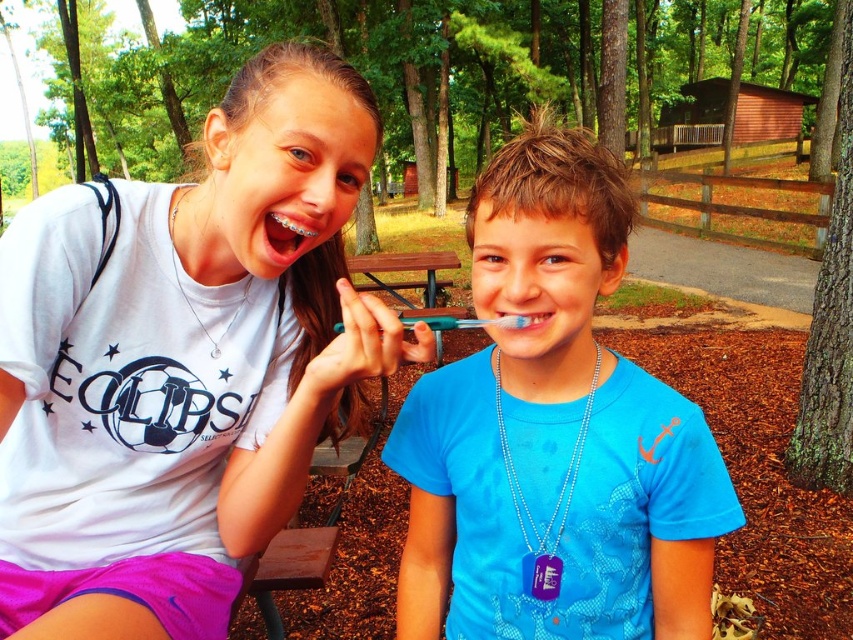
Can you confirm if metallic braces at center is shorter than blue plastic toothbrush at center?

No, metallic braces at center is not shorter than blue plastic toothbrush at center.

Between point (296, 212) and point (412, 324), which one is positioned in front?

Point (412, 324)

Where is `metallic braces at center`? This screenshot has height=640, width=853. metallic braces at center is located at coordinates (289, 234).

Image resolution: width=853 pixels, height=640 pixels. I want to click on metallic braces at center, so click(x=289, y=234).

Can you confirm if brown wooden picnic table at center is taller than blue plastic toothbrush at center?

Indeed, brown wooden picnic table at center has a greater height compared to blue plastic toothbrush at center.

Is the position of brown wooden picnic table at center less distant than that of blue plastic toothbrush at center?

Yes, it is in front of blue plastic toothbrush at center.

Between point (425, 282) and point (514, 317), which one is positioned in front?

Point (514, 317) is more forward.

This screenshot has height=640, width=853. I want to click on brown wooden picnic table at center, so click(408, 282).

Can you confirm if white matte t-shirt at upper left is taller than blue matte toothbrush at center?

No.

Is white matte t-shirt at upper left bigger than blue matte toothbrush at center?

Indeed, white matte t-shirt at upper left has a larger size compared to blue matte toothbrush at center.

Is point (22, 308) farther from viewer compared to point (653, 563)?

No, (22, 308) is in front of (653, 563).

Where is `white matte t-shirt at upper left`? white matte t-shirt at upper left is located at coordinates (181, 364).